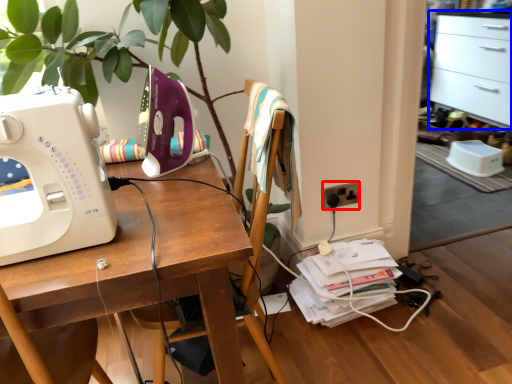
Question: Which of the following is the farthest to the observer, electric outlet (highlighted by a red box) or file cabinet (highlighted by a blue box)?

Choices:
 (A) electric outlet
 (B) file cabinet

Answer: (B)